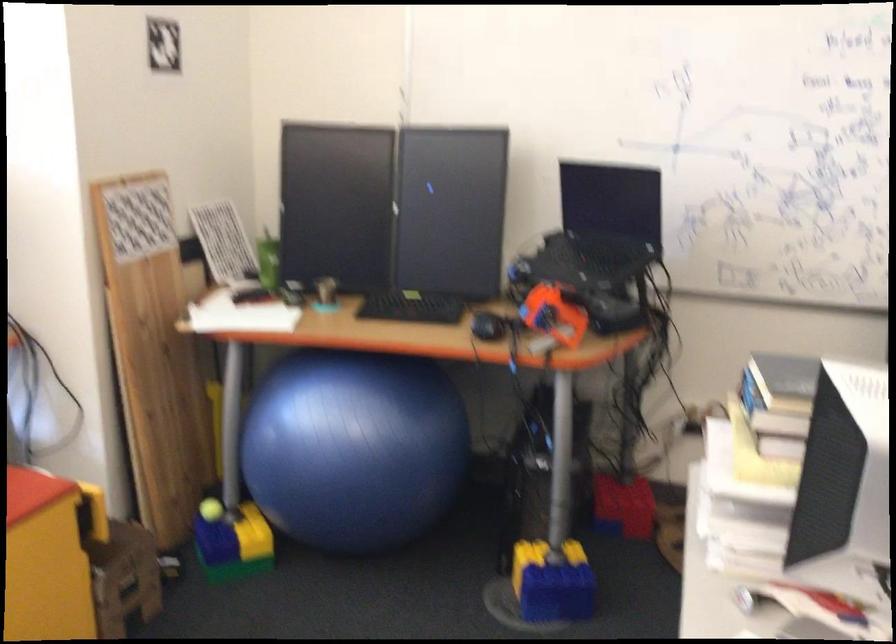
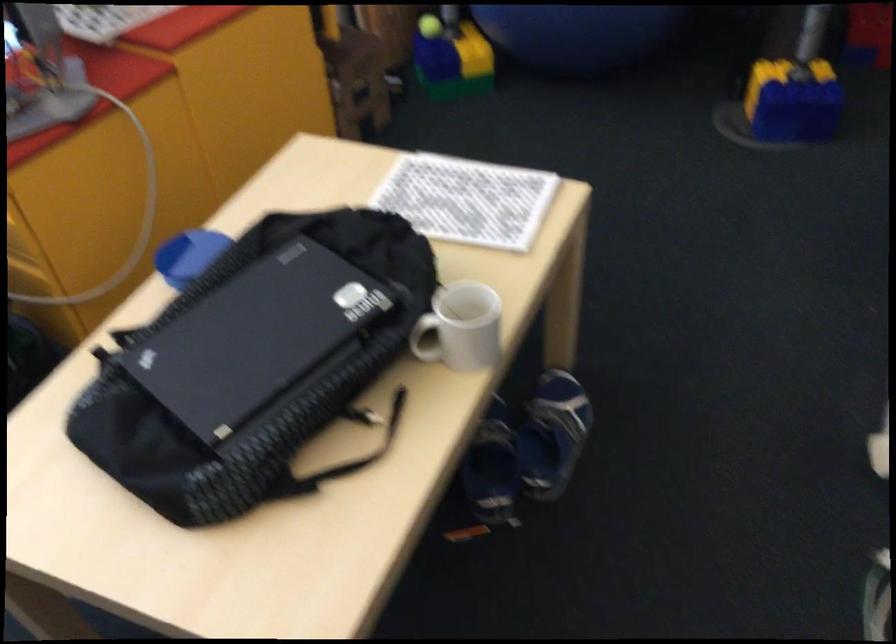
The point at [208,504] is marked in the first image. Where is the corresponding point in the second image?

(428, 26)